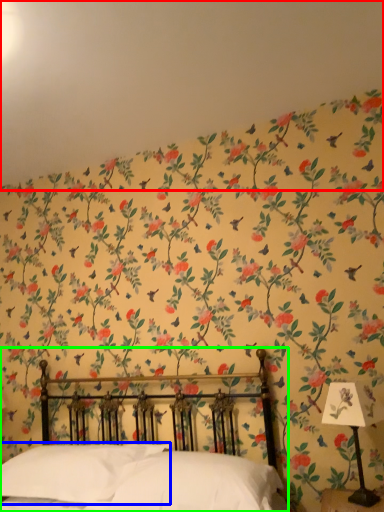
Question: Which object is the farthest from backdrop (highlighted by a red box)? Choose among these: pillow (highlighted by a blue box) or bed (highlighted by a green box).

Choices:
 (A) pillow
 (B) bed

Answer: (A)